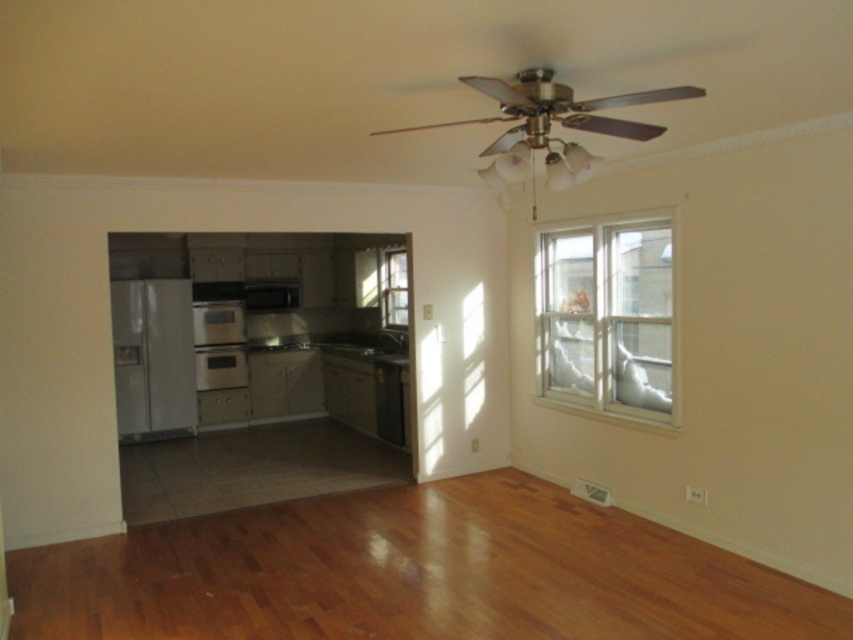
Find the location of a particular element. white glass window at upper right is located at coordinates (607, 316).

This screenshot has width=853, height=640. Describe the element at coordinates (607, 316) in the screenshot. I see `white glass window at upper right` at that location.

Find the location of `white glass window at upper right`. white glass window at upper right is located at coordinates (607, 316).

You are a GUI agent. You are given a task and a screenshot of the screen. Output one action in this format:
    pyautogui.click(x=<x>, y=<y>)
    Task: Click on the white glass window at upper right
    
    Given the screenshot: What is the action you would take?
    pyautogui.click(x=607, y=316)

Which is above, white glossy refrigerator at left or black matte dishwasher at lower center?

white glossy refrigerator at left is above.

Does point (193, 362) come behind point (374, 372)?

Yes, it is behind point (374, 372).

Is point (167, 296) positioned behind point (386, 362)?

Yes, it is.

Where is `white glossy refrigerator at left`? The width and height of the screenshot is (853, 640). white glossy refrigerator at left is located at coordinates coord(154,356).

Is white glass window at upper right positioned before black matte dishwasher at lower center?

Yes.

Measure the distance between point (610,280) and camera.

Point (610,280) and camera are 17.33 feet apart.

Find the location of a particular element. white glass window at upper right is located at coordinates (607, 316).